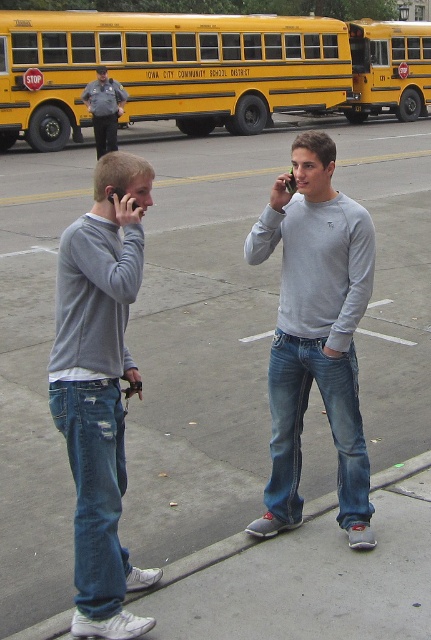
Question: Is concrete at lower center positioned before gray uniformed officer at upper left?

Choices:
 (A) yes
 (B) no

Answer: (A)

Question: Is ripped denim jeans at left bigger than yellow painted metal school bus at center?

Choices:
 (A) no
 (B) yes

Answer: (B)

Question: Which object is farther from the camera taking this photo?

Choices:
 (A) ripped denim jeans at left
 (B) yellow painted metal school bus at center
 (C) concrete at lower center
 (D) yellow painted school bus at upper center

Answer: (B)

Question: Which object appears closest to the camera in this image?

Choices:
 (A) yellow painted metal school bus at center
 (B) ripped denim jeans at left
 (C) yellow painted school bus at upper center
 (D) concrete at lower center

Answer: (B)

Question: Which point is farther to the camera?

Choices:
 (A) (65, 93)
 (B) (339, 400)
 (C) (102, 156)
 (D) (102, 378)

Answer: (A)

Question: Can you confirm if concrete at lower center is positioned to the right of gray uniformed officer at upper left?

Choices:
 (A) no
 (B) yes

Answer: (B)